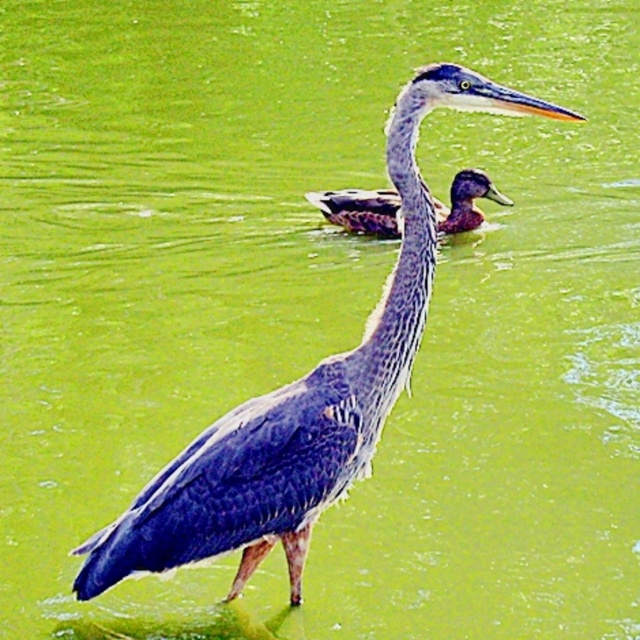
You are a photographer trying to capture the blue feathered heron at center in the image. If your camera is set to focus at point coordinates of 0.625, 0.473, will it successfully focus on the bird?

Yes, the blue feathered heron at center is exactly at point coordinates of (301,400), so the camera will successfully focus on the bird.